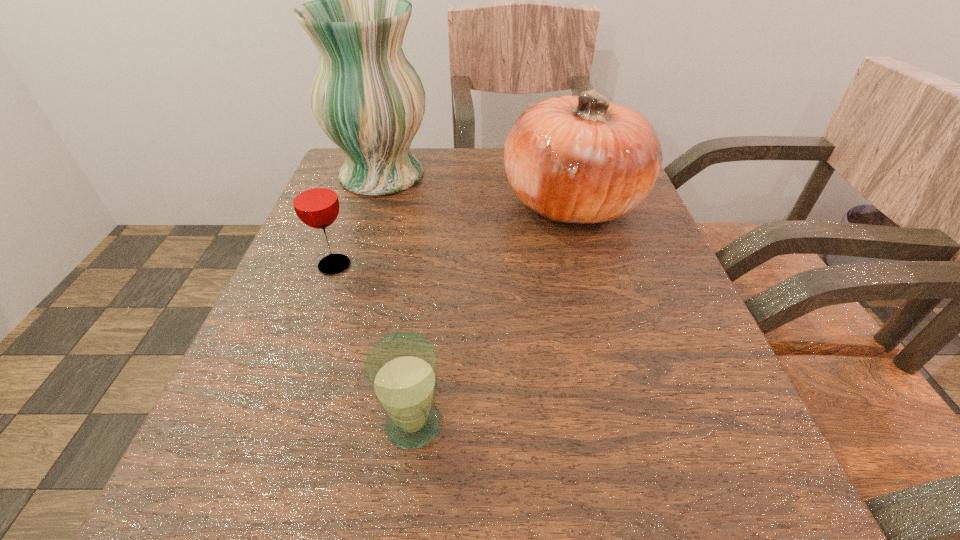
Find the location of a particular element. The image size is (960, 540). blank region between the farther glass and the vase is located at coordinates (358, 220).

Locate an element on the screen. This screenshot has height=540, width=960. free space between the tallest object and the right glass is located at coordinates (397, 300).

Locate an element on the screen. unoccupied position between the rightmost object and the tallest object is located at coordinates (477, 189).

You are a GUI agent. You are given a task and a screenshot of the screen. Output one action in this format:
    pyautogui.click(x=<x>, y=<y>)
    Task: Click on the free space between the second nearest object and the vase
    This screenshot has height=540, width=960.
    Given the screenshot: What is the action you would take?
    pyautogui.click(x=358, y=220)

Locate an element on the screen. unoccupied position between the tallest object and the shortest object is located at coordinates (397, 300).

You are a GUI agent. You are given a task and a screenshot of the screen. Output one action in this format:
    pyautogui.click(x=<x>, y=<y>)
    Task: Click on the object that stands as the third closest to the vase
    The width and height of the screenshot is (960, 540).
    Given the screenshot: What is the action you would take?
    pyautogui.click(x=401, y=368)

The image size is (960, 540). In order to click on the second closest object to the nearer glass in this screenshot , I will do `click(581, 159)`.